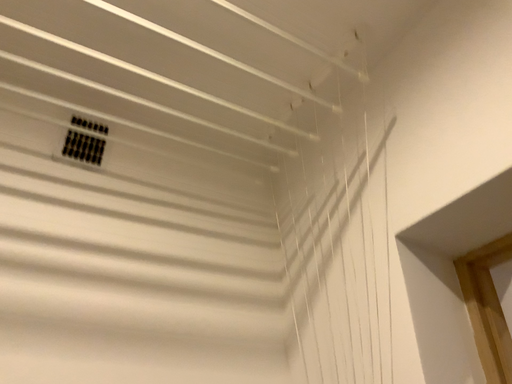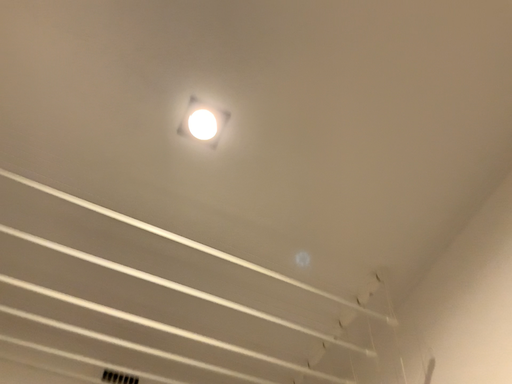
Question: Which way did the camera rotate in the video?

Choices:
 (A) rotated upward
 (B) rotated downward

Answer: (A)